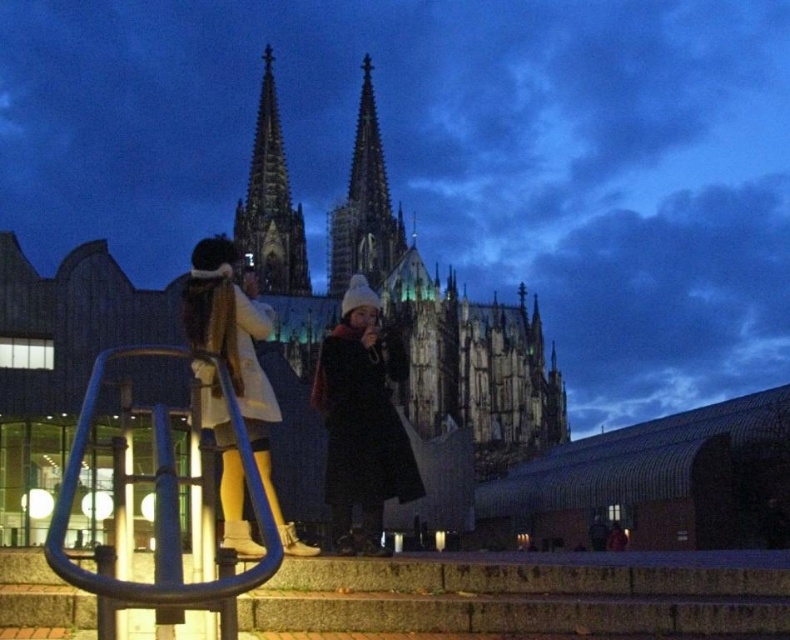
Question: Is white woolen hat at center bigger than dark gray stone spire at center?

Choices:
 (A) yes
 (B) no

Answer: (A)

Question: Which of the following is the farthest from the observer?

Choices:
 (A) white woolen hat at center
 (B) black matte coat at center
 (C) dark gray stone spire at center

Answer: (C)

Question: Can you confirm if white woolen hat at center is smaller than dark brown leather coat at center?

Choices:
 (A) no
 (B) yes

Answer: (A)

Question: Which point appears farthest from the camera in this image?

Choices:
 (A) (619, 547)
 (B) (258, 144)
 (C) (356, 177)

Answer: (C)

Question: Can you confirm if black matte coat at center is bigger than white woolen hat at center?

Choices:
 (A) no
 (B) yes

Answer: (A)

Question: Which is nearer to the dark gray stone tower at center?

Choices:
 (A) white woolen hat at center
 (B) black matte coat at center

Answer: (A)